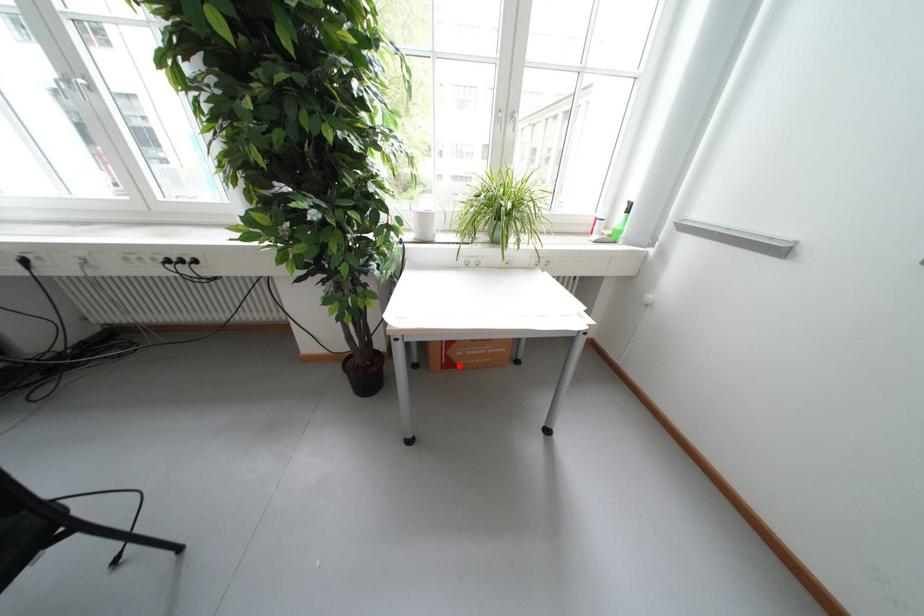
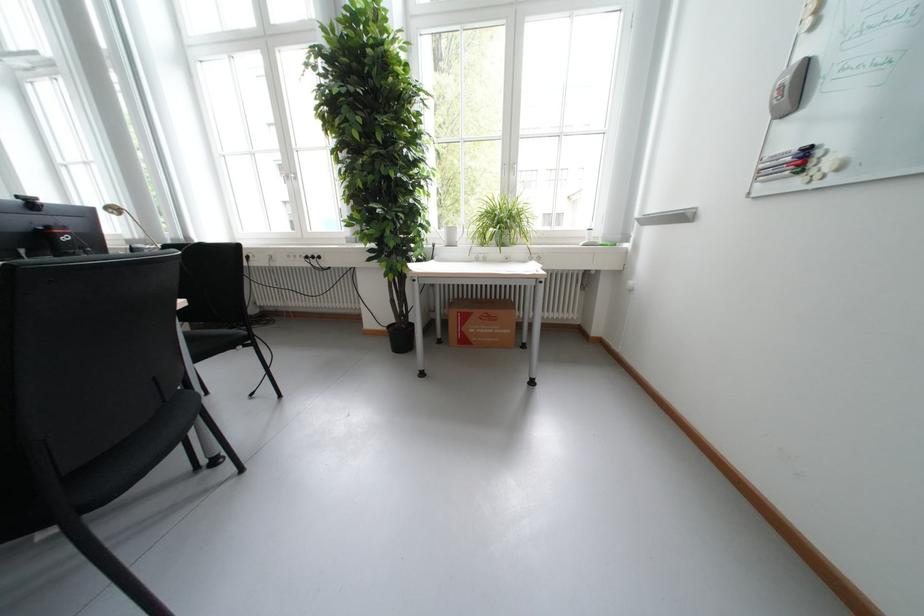
The point at the highlighted location is marked in the first image. Where is the corresponding point in the second image?

(475, 342)